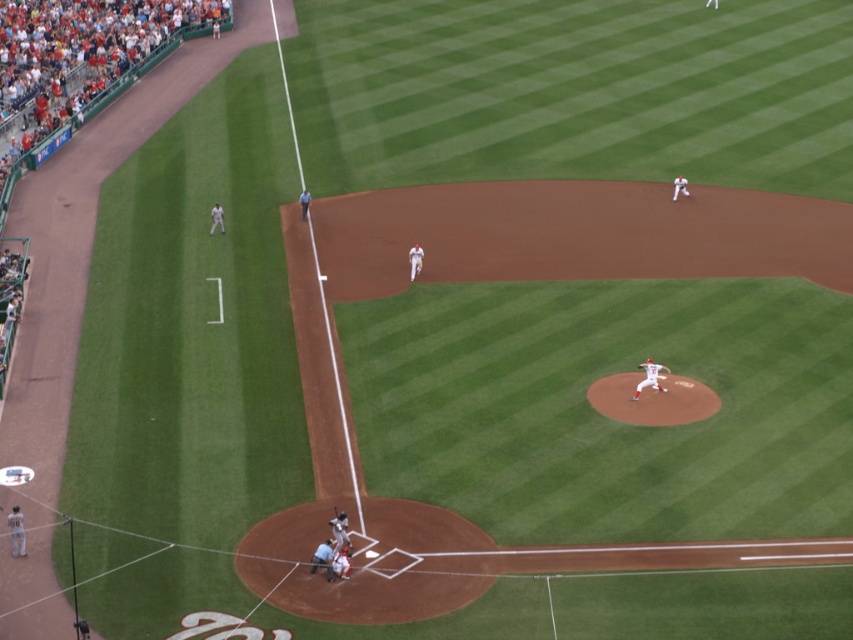
Can you confirm if white matte bat at lower center is smaller than wooden bat at home plate?

No.

Is white matte bat at lower center closer to the viewer compared to wooden bat at home plate?

Yes, it is in front of wooden bat at home plate.

I want to click on white matte bat at lower center, so click(x=339, y=531).

Between white matte baseball pitcher at center and white matte bat at lower center, which one appears on the right side from the viewer's perspective?

white matte baseball pitcher at center

Can you confirm if white matte baseball pitcher at center is positioned to the left of white matte bat at lower center?

In fact, white matte baseball pitcher at center is to the right of white matte bat at lower center.

Find the location of `white matte baseball pitcher at center`. white matte baseball pitcher at center is located at coordinates (648, 378).

Image resolution: width=853 pixels, height=640 pixels. Find the location of `white fabric referee at lower center`. white fabric referee at lower center is located at coordinates (323, 557).